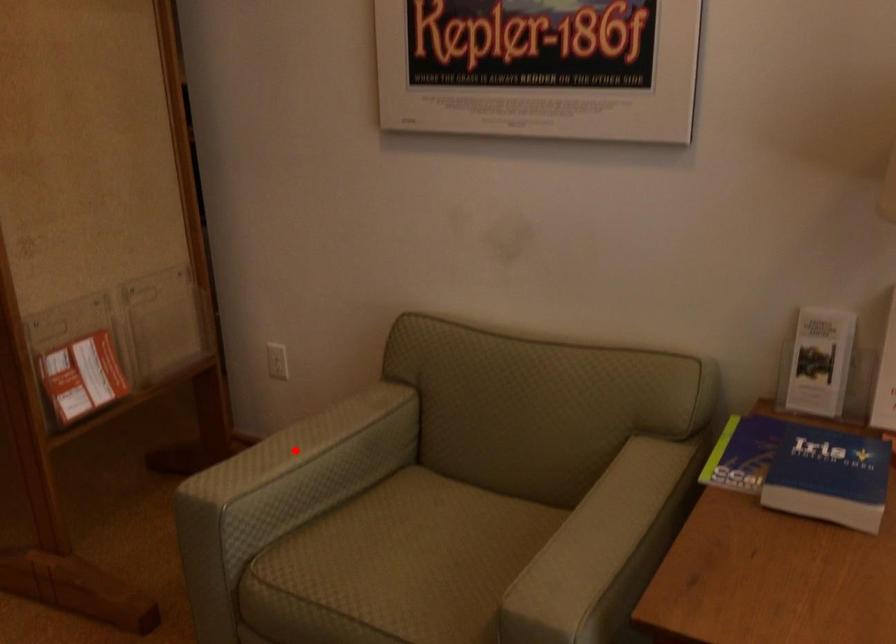
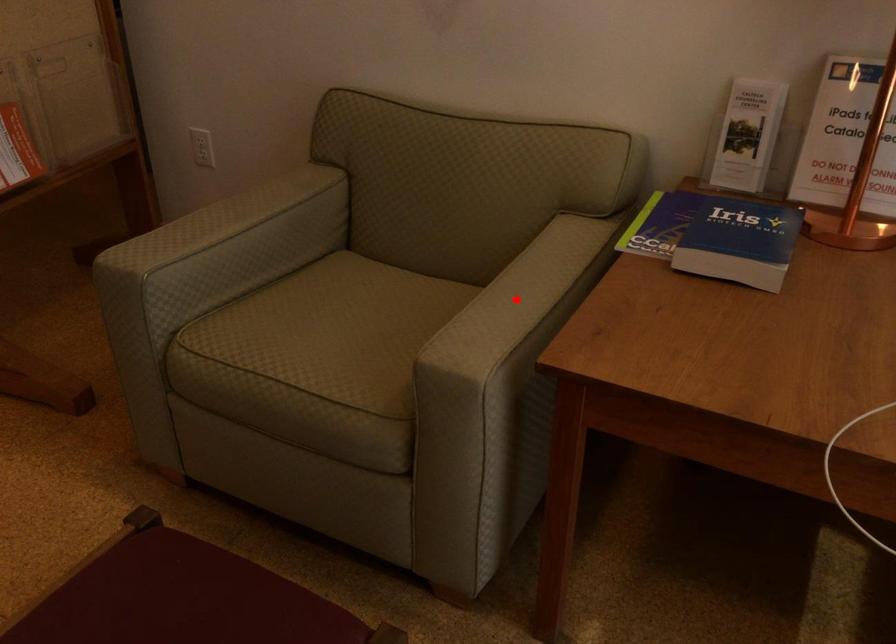
I am providing you with two images of the same scene from different viewpoints. A red point is marked on the first image and another point is marked on the second image. Does the point marked in image1 correspond to the same location as the one in image2?

No